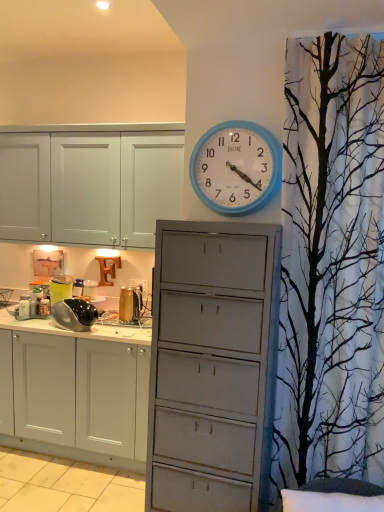
This screenshot has height=512, width=384. What do you see at coordinates (60, 288) in the screenshot?
I see `metallic silver pot at left, the first appliance when ordered from left to right` at bounding box center [60, 288].

What do you see at coordinates (74, 314) in the screenshot? I see `black glossy kettle at left, acting as the second appliance starting from the left` at bounding box center [74, 314].

How much space does gold metallic kettle at center, placed as the 3th appliance when sorted from left to right, occupy vertically?

It is 9.58 inches.

The image size is (384, 512). In order to click on metallic silver pot at left, placed as the 3th appliance when sorted from right to left in this screenshot , I will do `click(60, 288)`.

From the image's perspective, is gold metallic kettle at center, placed as the 3th appliance when sorted from left to right, located above or below metallic silver pot at left, placed as the 3th appliance when sorted from right to left?

Based on their image positions, gold metallic kettle at center, placed as the 3th appliance when sorted from left to right, is located beneath metallic silver pot at left, placed as the 3th appliance when sorted from right to left.

Which object is positioned more to the right, gold metallic kettle at center, placed as the 3th appliance when sorted from left to right, or metallic silver pot at left, placed as the 3th appliance when sorted from right to left?

gold metallic kettle at center, placed as the 3th appliance when sorted from left to right.

Which of these two, gold metallic kettle at center, placed as the 3th appliance when sorted from left to right, or metallic silver pot at left, the first appliance when ordered from left to right, stands taller?

Standing taller between the two is metallic silver pot at left, the first appliance when ordered from left to right.

Could you tell me if gold metallic kettle at center, acting as the 1th appliance starting from the right, is turned towards metallic silver pot at left, the first appliance when ordered from left to right?

No.

Which object is closer to the camera taking this photo, metallic silver pot at left, the first appliance when ordered from left to right, or blue plastic wall clock at upper center?

blue plastic wall clock at upper center.

At what (x,y) coordinates should I click in order to perform the action: click on the 1st appliance directly beneath the blue plastic wall clock at upper center (from a real-world perspective). Please return your answer as a coordinate pair (x, y). This screenshot has width=384, height=512. Looking at the image, I should click on (x=60, y=288).

From the image's perspective, is metallic silver pot at left, the first appliance when ordered from left to right, on blue plastic wall clock at upper center?

Actually, metallic silver pot at left, the first appliance when ordered from left to right, appears below blue plastic wall clock at upper center in the image.

Is metallic silver pot at left, the first appliance when ordered from left to right, with blue plastic wall clock at upper center?

No, metallic silver pot at left, the first appliance when ordered from left to right, is not beside blue plastic wall clock at upper center.

From the picture: Is black glossy kettle at left, the 2th appliance in the right-to-left sequence, located within blue plastic wall clock at upper center?

No, black glossy kettle at left, the 2th appliance in the right-to-left sequence, is not inside blue plastic wall clock at upper center.

In terms of width, does blue plastic wall clock at upper center look wider or thinner when compared to black glossy kettle at left, acting as the second appliance starting from the left?

blue plastic wall clock at upper center is thinner than black glossy kettle at left, acting as the second appliance starting from the left.

Which is behind, point (244, 192) or point (91, 304)?

The point (91, 304) is farther from the camera.

From the image's perspective, does black glossy kettle at left, acting as the second appliance starting from the left, appear lower than gold metallic kettle at center, placed as the 3th appliance when sorted from left to right?

Yes, from the image's perspective, black glossy kettle at left, acting as the second appliance starting from the left, is below gold metallic kettle at center, placed as the 3th appliance when sorted from left to right.

Are black glossy kettle at left, acting as the second appliance starting from the left, and gold metallic kettle at center, placed as the 3th appliance when sorted from left to right, located far from each other?

They are positioned close to each other.

Is black glossy kettle at left, acting as the second appliance starting from the left, in front of or behind gold metallic kettle at center, placed as the 3th appliance when sorted from left to right, in the image?

In the image, black glossy kettle at left, acting as the second appliance starting from the left, appears in front of gold metallic kettle at center, placed as the 3th appliance when sorted from left to right.

Can you confirm if metallic silver pot at left, placed as the 3th appliance when sorted from right to left, is wider than black glossy kettle at left, acting as the second appliance starting from the left?

No, metallic silver pot at left, placed as the 3th appliance when sorted from right to left, is not wider than black glossy kettle at left, acting as the second appliance starting from the left.

Can black glossy kettle at left, acting as the second appliance starting from the left, be found inside metallic silver pot at left, the first appliance when ordered from left to right?

No, black glossy kettle at left, acting as the second appliance starting from the left, is not inside metallic silver pot at left, the first appliance when ordered from left to right.

From a real-world perspective, is metallic silver pot at left, placed as the 3th appliance when sorted from right to left, physically located above or below black glossy kettle at left, acting as the second appliance starting from the left?

metallic silver pot at left, placed as the 3th appliance when sorted from right to left, is situated higher than black glossy kettle at left, acting as the second appliance starting from the left, in the real world.

From the image's perspective, would you say metallic silver pot at left, placed as the 3th appliance when sorted from right to left, is positioned over black glossy kettle at left, the 2th appliance in the right-to-left sequence?

Yes, from the image's perspective, metallic silver pot at left, placed as the 3th appliance when sorted from right to left, is on top of black glossy kettle at left, the 2th appliance in the right-to-left sequence.

Which object is closer to the camera taking this photo, black glossy kettle at left, the 2th appliance in the right-to-left sequence, or blue plastic wall clock at upper center?

blue plastic wall clock at upper center is more forward.

Can we say black glossy kettle at left, acting as the second appliance starting from the left, lies outside blue plastic wall clock at upper center?

Absolutely, black glossy kettle at left, acting as the second appliance starting from the left, is external to blue plastic wall clock at upper center.

Considering the points (67, 323) and (276, 177), which point is in front, point (67, 323) or point (276, 177)?

The point (276, 177) is closer.

The height and width of the screenshot is (512, 384). In order to click on appliance that is the 1st object to the left of the gold metallic kettle at center, placed as the 3th appliance when sorted from left to right, starting at the anchor in this screenshot , I will do `click(74, 314)`.

Could you tell me if gold metallic kettle at center, placed as the 3th appliance when sorted from left to right, is turned towards black glossy kettle at left, the 2th appliance in the right-to-left sequence?

No, gold metallic kettle at center, placed as the 3th appliance when sorted from left to right, does not turn towards black glossy kettle at left, the 2th appliance in the right-to-left sequence.

Which is in front, point (133, 296) or point (95, 318)?

The point (95, 318) is in front.

Which object is thinner, gold metallic kettle at center, acting as the 1th appliance starting from the right, or black glossy kettle at left, acting as the second appliance starting from the left?

gold metallic kettle at center, acting as the 1th appliance starting from the right.

Identify the location of appliance lying behind the gold metallic kettle at center, placed as the 3th appliance when sorted from left to right. This screenshot has width=384, height=512. (60, 288).

Identify the location of appliance that is the 3rd object to the left of the blue plastic wall clock at upper center, starting at the anchor. This screenshot has height=512, width=384. (60, 288).

Based on their spatial positions, is metallic silver pot at left, the first appliance when ordered from left to right, or blue plastic wall clock at upper center closer to black glossy kettle at left, acting as the second appliance starting from the left?

Based on the image, metallic silver pot at left, the first appliance when ordered from left to right, appears to be nearer to black glossy kettle at left, acting as the second appliance starting from the left.

Estimate the real-world distances between objects in this image. Which object is further from gold metallic kettle at center, acting as the 1th appliance starting from the right, black glossy kettle at left, the 2th appliance in the right-to-left sequence, or blue plastic wall clock at upper center?

Based on the image, blue plastic wall clock at upper center appears to be further to gold metallic kettle at center, acting as the 1th appliance starting from the right.

Which object lies further to the anchor point blue plastic wall clock at upper center, metallic silver pot at left, the first appliance when ordered from left to right, or black glossy kettle at left, acting as the second appliance starting from the left?

Among the two, metallic silver pot at left, the first appliance when ordered from left to right, is located further to blue plastic wall clock at upper center.

Considering their positions, is metallic silver pot at left, placed as the 3th appliance when sorted from right to left, positioned closer to black glossy kettle at left, the 2th appliance in the right-to-left sequence, than gold metallic kettle at center, placed as the 3th appliance when sorted from left to right?

metallic silver pot at left, placed as the 3th appliance when sorted from right to left, lies closer to black glossy kettle at left, the 2th appliance in the right-to-left sequence, than the other object.

From the image, which object appears to be farther from black glossy kettle at left, the 2th appliance in the right-to-left sequence, blue plastic wall clock at upper center or gold metallic kettle at center, acting as the 1th appliance starting from the right?

blue plastic wall clock at upper center.

Looking at this image, estimate the real-world distances between objects in this image. Which object is further from gold metallic kettle at center, acting as the 1th appliance starting from the right, blue plastic wall clock at upper center or metallic silver pot at left, placed as the 3th appliance when sorted from right to left?

blue plastic wall clock at upper center lies further to gold metallic kettle at center, acting as the 1th appliance starting from the right, than the other object.

Looking at the image, which one is located further to black glossy kettle at left, the 2th appliance in the right-to-left sequence, gold metallic kettle at center, placed as the 3th appliance when sorted from left to right, or metallic silver pot at left, the first appliance when ordered from left to right?

Among the two, gold metallic kettle at center, placed as the 3th appliance when sorted from left to right, is located further to black glossy kettle at left, the 2th appliance in the right-to-left sequence.

Considering their positions, is metallic silver pot at left, placed as the 3th appliance when sorted from right to left, positioned further to blue plastic wall clock at upper center than gold metallic kettle at center, placed as the 3th appliance when sorted from left to right?

metallic silver pot at left, placed as the 3th appliance when sorted from right to left, lies further to blue plastic wall clock at upper center than the other object.

You are a GUI agent. You are given a task and a screenshot of the screen. Output one action in this format:
    pyautogui.click(x=<x>, y=<y>)
    Task: Click on the appliance between metallic silver pot at left, placed as the 3th appliance when sorted from right to left, and gold metallic kettle at center, placed as the 3th appliance when sorted from left to right, from left to right
    This screenshot has width=384, height=512.
    Given the screenshot: What is the action you would take?
    pyautogui.click(x=74, y=314)

Where is `appliance between blue plastic wall clock at upper center and gold metallic kettle at center, placed as the 3th appliance when sorted from left to right, from front to back`? This screenshot has height=512, width=384. appliance between blue plastic wall clock at upper center and gold metallic kettle at center, placed as the 3th appliance when sorted from left to right, from front to back is located at coordinates (74, 314).